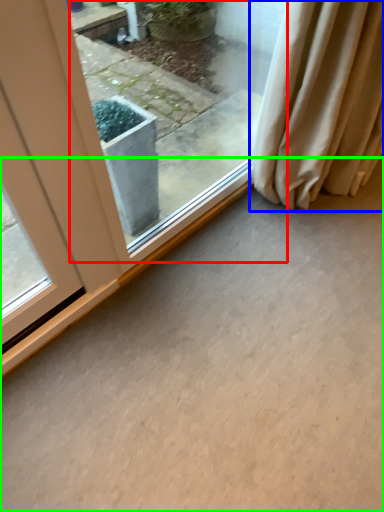
Question: Considering the real-world distances, which object is farthest from window (highlighted by a red box)? curtain (highlighted by a blue box) or concrete (highlighted by a green box)?

Choices:
 (A) curtain
 (B) concrete

Answer: (B)